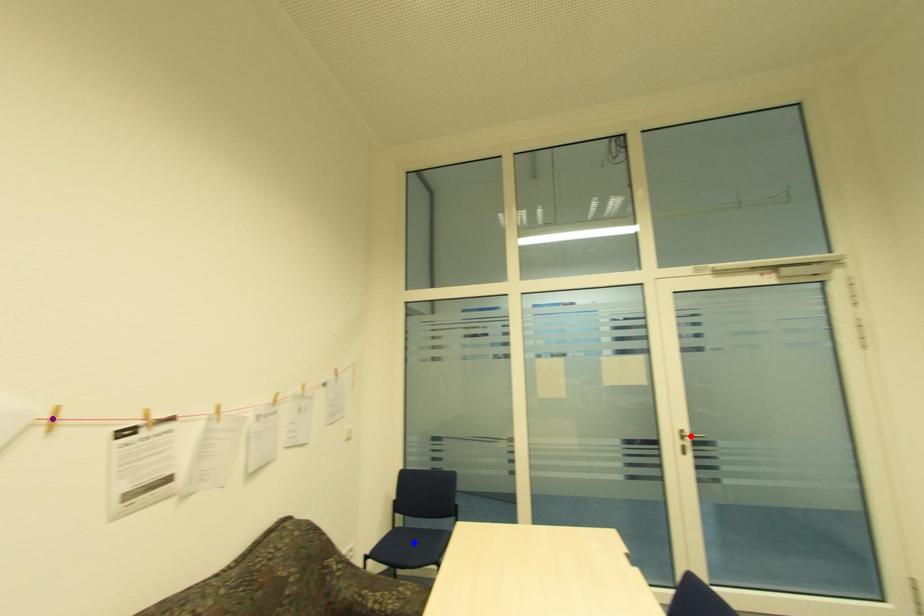
Order these from farthest to nearest:
- red point
- blue point
- purple point

blue point → red point → purple point